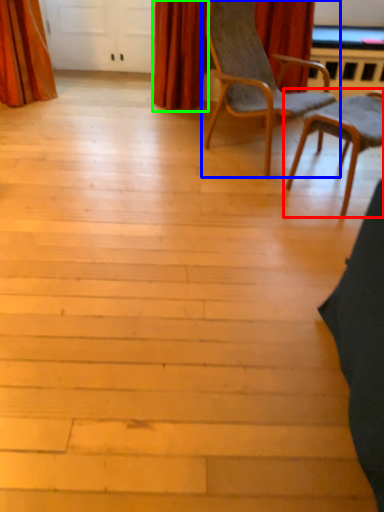
Question: Which object is the farthest from chair (highlighted by a red box)? Choose among these: chair (highlighted by a blue box) or curtain (highlighted by a green box).

Choices:
 (A) chair
 (B) curtain

Answer: (B)